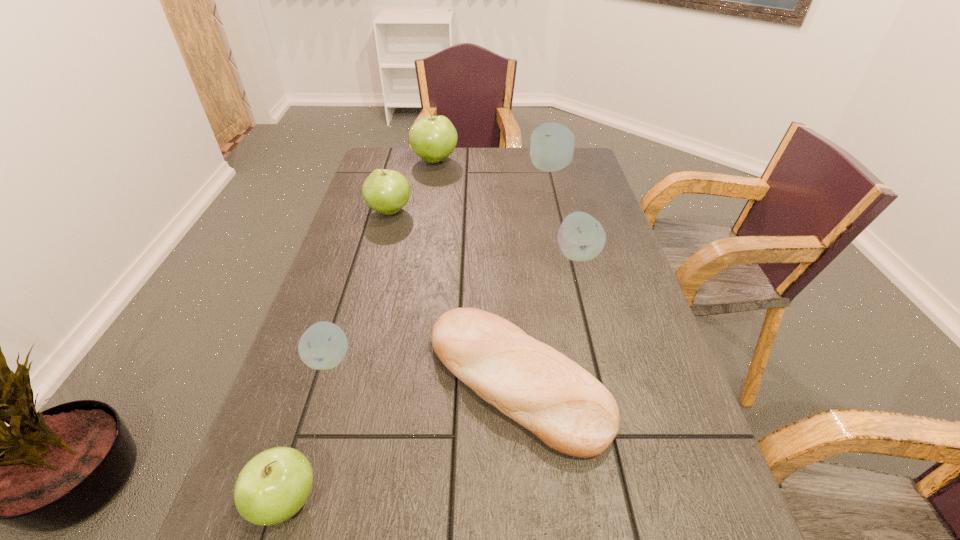
Where is `object that is the third nearest to the farthest green apple`? This screenshot has width=960, height=540. object that is the third nearest to the farthest green apple is located at coordinates (581, 237).

You are a GUI agent. You are given a task and a screenshot of the screen. Output one action in this format:
    pyautogui.click(x=<x>, y=<y>)
    Task: Click on the object that is the second closest to the bread
    This screenshot has height=540, width=960.
    Given the screenshot: What is the action you would take?
    pyautogui.click(x=323, y=346)

Identify which apple is located as the third nearest to the leftmost white apple. Please provide its 2D coordinates. Your answer should be formatted as a tuple, i.e. [(x, y)], where the tuple contains the x and y coordinates of a point satisfying the conditions above.

[(581, 237)]

Choose which apple is the fourth nearest neighbor to the fourth nearest apple. Please provide its 2D coordinates. Your answer should be formatted as a tuple, i.e. [(x, y)], where the tuple contains the x and y coordinates of a point satisfying the conditions above.

[(323, 346)]

This screenshot has width=960, height=540. What are the coordinates of `green apple that is the closest to the nearest apple` in the screenshot? It's located at (386, 191).

Image resolution: width=960 pixels, height=540 pixels. Find the location of `green apple identified as the second closest to the farthest white apple`. green apple identified as the second closest to the farthest white apple is located at coordinates (386, 191).

Find the location of `white apple that is the second closest one to the second smallest green apple`. white apple that is the second closest one to the second smallest green apple is located at coordinates (581, 237).

Where is `white apple that is the third closest to the fifth nearest object`? This screenshot has height=540, width=960. white apple that is the third closest to the fifth nearest object is located at coordinates (323, 346).